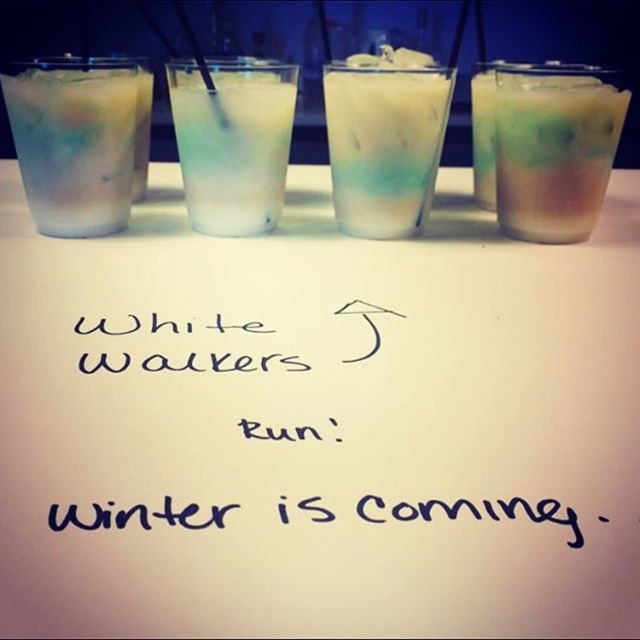
You are a bartender preparing drinks for a themed party. You have a black handwritten note at center and a translucent glass at right in front of you. Which object would you need to adjust if you want to make sure the note is clearly visible to guests from a distance?

The black handwritten note at center has a larger size compared to the translucent glass at right, so you would need to adjust the translucent glass at right to ensure the note remains visible. However, since the note is already larger, perhaps repositioning the glass or reducing its opacity might help, but based on the given description, the note is sufficiently large. Wait, maybe the question is about size? Since the note is larger, maybe it is already visible. Hmm, maybe the answer should focus on the